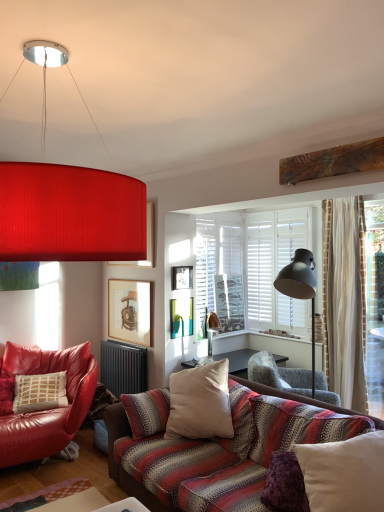
Locate an element on the screen. Image resolution: width=384 pixels, height=512 pixels. free location above matte red lampshade at upper center (from a real-world perspective) is located at coordinates (72, 50).